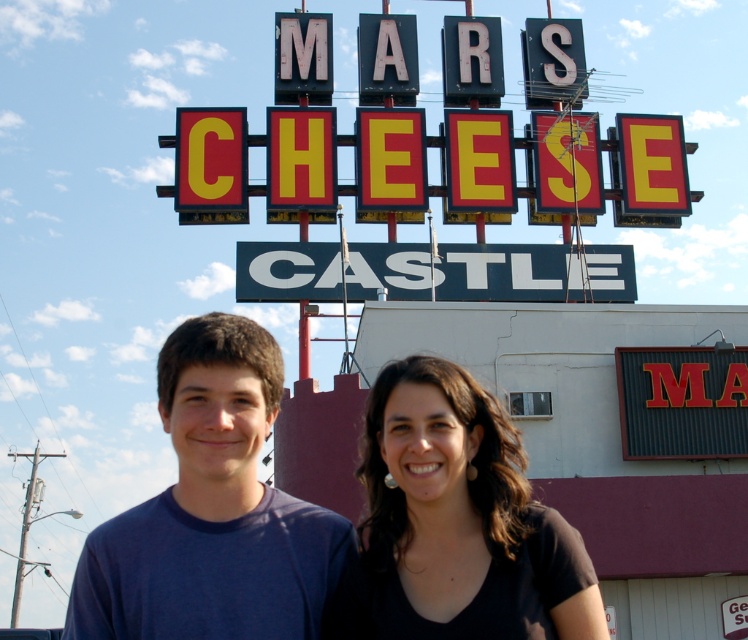
Does blue t-shirt at center appear under black matte hair at center?

Actually, blue t-shirt at center is above black matte hair at center.

Is blue t-shirt at center positioned in front of black matte hair at center?

Yes, it is.

Identify the location of blue t-shirt at center. Image resolution: width=748 pixels, height=640 pixels. (212, 512).

Which is behind, point (337, 534) or point (533, 148)?

The point (533, 148) is behind.

The image size is (748, 640). I want to click on blue t-shirt at center, so click(x=212, y=512).

In the scene shown: Between metallic yellow lettering at center and black matte hair at center, which one has less height?

With less height is black matte hair at center.

Between metallic yellow lettering at center and black matte hair at center, which one appears on the left side from the viewer's perspective?

From the viewer's perspective, black matte hair at center appears more on the left side.

Does point (408, 161) lie behind point (384, 624)?

That is True.

Identify the location of metallic yellow lettering at center. The width and height of the screenshot is (748, 640). (487, 156).